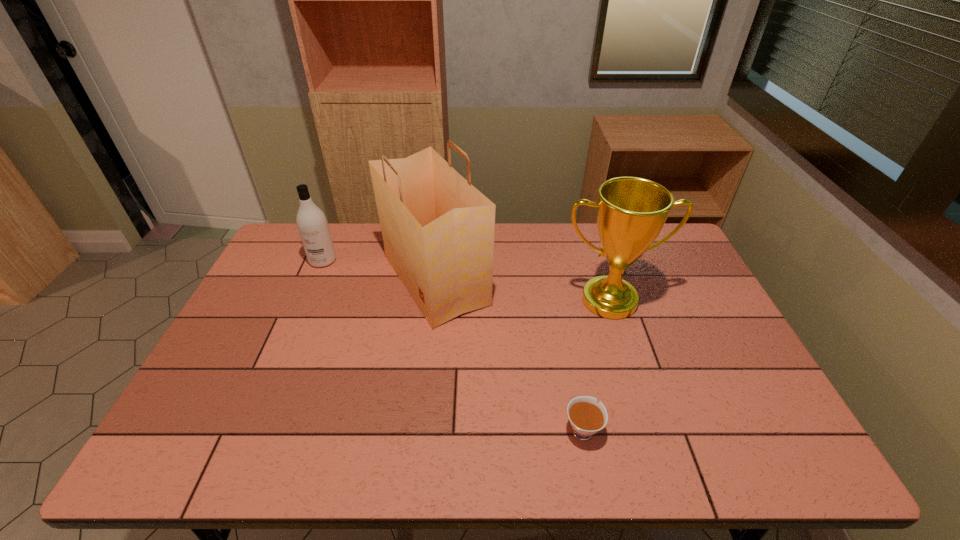
Where is `the third object from right to left`? The width and height of the screenshot is (960, 540). the third object from right to left is located at coordinates (x=438, y=230).

The width and height of the screenshot is (960, 540). What are the coordinates of `the second tallest object` in the screenshot? It's located at (631, 212).

The width and height of the screenshot is (960, 540). In order to click on shampoo in this screenshot , I will do `click(313, 228)`.

Locate an element on the screen. The width and height of the screenshot is (960, 540). the second shortest object is located at coordinates (313, 228).

Locate an element on the screen. teacup is located at coordinates (587, 417).

Image resolution: width=960 pixels, height=540 pixels. Find the location of `the nearest object`. the nearest object is located at coordinates (587, 417).

This screenshot has width=960, height=540. Identify the location of free space located on the side of the third object from right to left with the superhero design. (544, 280).

Find the location of a particular element. The image size is (960, 540). free location located 0.080m by the handles of the third shortest object is located at coordinates (622, 343).

The image size is (960, 540). I want to click on vacant space located 0.100m on the front-facing side of the shampoo, so click(310, 289).

Identify the location of free region located 0.280m on the side of the nearest object with the handle. (562, 325).